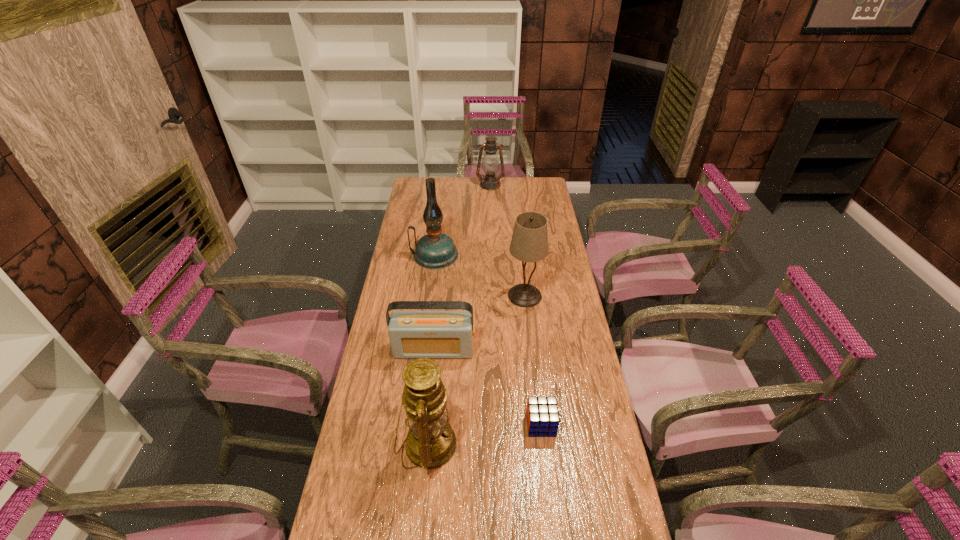
The width and height of the screenshot is (960, 540). Find the location of `the farthest object`. the farthest object is located at coordinates [x=490, y=164].

Locate an element on the screen. The width and height of the screenshot is (960, 540). the rightmost oil lamp is located at coordinates (490, 164).

This screenshot has height=540, width=960. I want to click on lampshade, so click(x=529, y=243).

Identify the location of the second nearest oil lamp. (436, 250).

The width and height of the screenshot is (960, 540). What are the coordinates of `the nearest oil lamp` in the screenshot? It's located at (431, 442).

I want to click on the fourth farthest object, so click(413, 334).

The width and height of the screenshot is (960, 540). Identify the location of radio receiver. (413, 334).

The height and width of the screenshot is (540, 960). What are the coordinates of `cube` in the screenshot? It's located at (542, 415).

In order to click on vacant area situated on the left of the farthest oil lamp in this screenshot , I will do `click(458, 185)`.

Where is `vacant space situated 0.180m on the front-facing side of the lampshade`? vacant space situated 0.180m on the front-facing side of the lampshade is located at coordinates (530, 345).